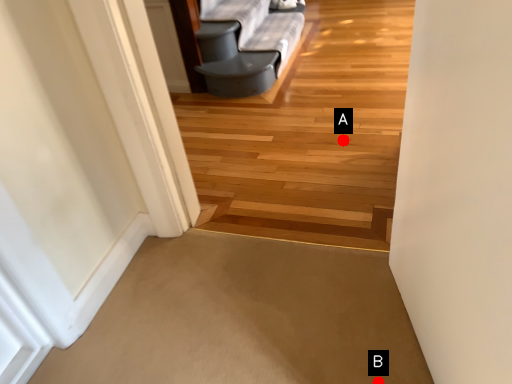
Question: Two points are circled on the image, labeled by A and B beside each circle. Which point is further to the camera?

Choices:
 (A) A is further
 (B) B is further

Answer: (A)